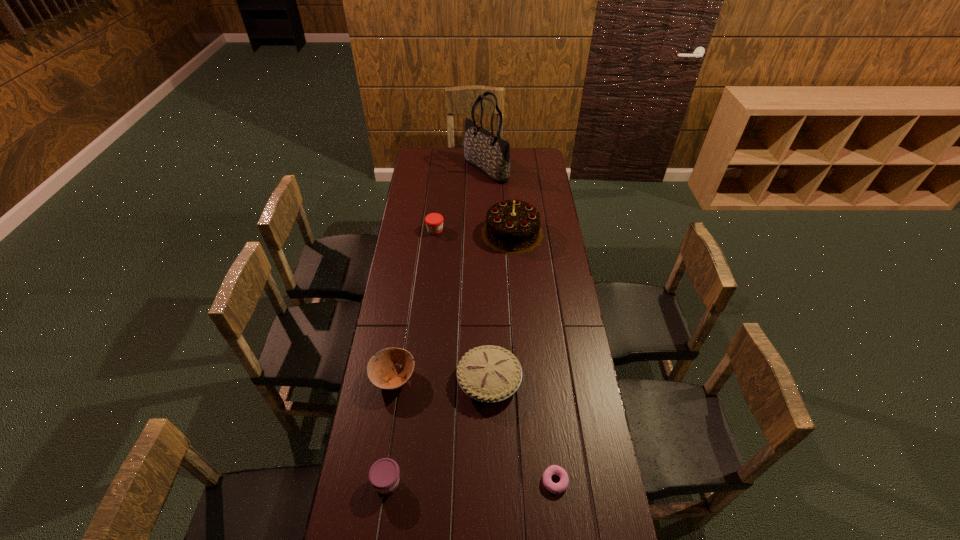
Find the location of `free space between the farthest object and the bowl`. free space between the farthest object and the bowl is located at coordinates (440, 274).

Locate an element on the screen. This screenshot has width=960, height=540. vacant region between the nearer jam and the pie is located at coordinates pyautogui.click(x=439, y=431).

Select which object appears as the second closest to the bowl. Please provide its 2D coordinates. Your answer should be formatted as a tuple, i.e. [(x, y)], where the tuple contains the x and y coordinates of a point satisfying the conditions above.

[(383, 475)]

Identify the location of the fourth closest object to the tote bag. The width and height of the screenshot is (960, 540). (380, 373).

This screenshot has width=960, height=540. Find the location of `free spot that satisfies the following two spatial constraints: 1. on the label side of the farther jam; 2. on the left side of the pie`. free spot that satisfies the following two spatial constraints: 1. on the label side of the farther jam; 2. on the left side of the pie is located at coordinates (419, 380).

Find the location of `free space that satisfies the following two spatial constraints: 1. on the back side of the pie; 2. on the left side of the birthday cake`. free space that satisfies the following two spatial constraints: 1. on the back side of the pie; 2. on the left side of the birthday cake is located at coordinates (487, 233).

Where is `free spot that satisfies the following two spatial constraints: 1. on the label side of the farther jam; 2. on the front label of the nearer jam`? This screenshot has height=540, width=960. free spot that satisfies the following two spatial constraints: 1. on the label side of the farther jam; 2. on the front label of the nearer jam is located at coordinates (408, 482).

The image size is (960, 540). I want to click on free spot that satisfies the following two spatial constraints: 1. on the front side of the shortest object; 2. on the left side of the bowl, so pos(377,481).

What are the coordinates of `free location that satisfies the following two spatial constraints: 1. on the label side of the farther jam; 2. on the left side of the pie` in the screenshot? It's located at (419, 380).

Image resolution: width=960 pixels, height=540 pixels. Identify the location of vacant space that satisfies the following two spatial constraints: 1. on the label side of the farther jam; 2. on the left side of the birthday cake. (435, 233).